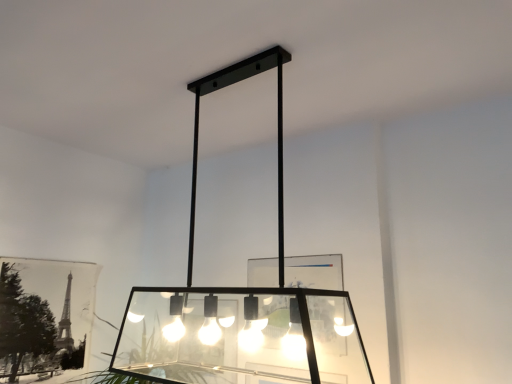
The width and height of the screenshot is (512, 384). Describe the element at coordinates (243, 304) in the screenshot. I see `matte black chandelier at center` at that location.

Locate an element on the screen. Image resolution: width=512 pixels, height=384 pixels. matte black chandelier at center is located at coordinates (243, 304).

Identify the location of matte black chandelier at center. The width and height of the screenshot is (512, 384). (243, 304).